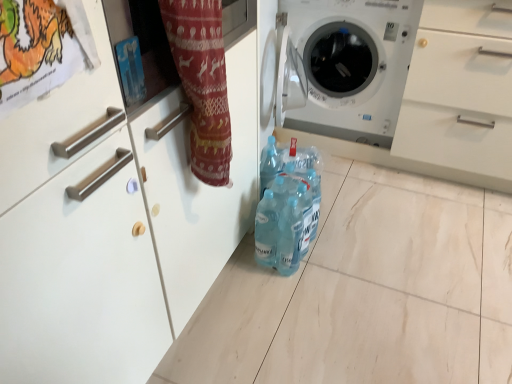
Question: Is translucent plastic bottles at center placed right next to white plastic washing machine at center?

Choices:
 (A) no
 (B) yes

Answer: (A)

Question: Can you confirm if translucent plastic bottles at center is smaller than white plastic washing machine at center?

Choices:
 (A) no
 (B) yes

Answer: (B)

Question: Considering the relative sizes of translucent plastic bottles at center and white plastic washing machine at center in the image provided, is translucent plastic bottles at center shorter than white plastic washing machine at center?

Choices:
 (A) no
 (B) yes

Answer: (B)

Question: Can we say translucent plastic bottles at center lies outside white plastic washing machine at center?

Choices:
 (A) no
 (B) yes

Answer: (B)

Question: From the image's perspective, is translucent plastic bottles at center beneath white plastic washing machine at center?

Choices:
 (A) no
 (B) yes

Answer: (B)

Question: Does translucent plastic bottles at center appear on the left side of white plastic washing machine at center?

Choices:
 (A) yes
 (B) no

Answer: (A)

Question: From a real-world perspective, is matte red fabric at center under translucent plastic bottles at center?

Choices:
 (A) yes
 (B) no

Answer: (B)

Question: Is matte red fabric at center closer to the viewer compared to translucent plastic bottles at center?

Choices:
 (A) no
 (B) yes

Answer: (B)

Question: Could translucent plastic bottles at center be considered to be inside matte red fabric at center?

Choices:
 (A) yes
 (B) no

Answer: (B)

Question: Does matte red fabric at center have a lesser height compared to translucent plastic bottles at center?

Choices:
 (A) no
 (B) yes

Answer: (A)

Question: Does matte red fabric at center appear on the right side of translucent plastic bottles at center?

Choices:
 (A) no
 (B) yes

Answer: (A)

Question: Does matte red fabric at center come behind translucent plastic bottles at center?

Choices:
 (A) yes
 (B) no

Answer: (B)

Question: Is the depth of matte red fabric at center greater than that of white plastic washing machine at center?

Choices:
 (A) yes
 (B) no

Answer: (B)